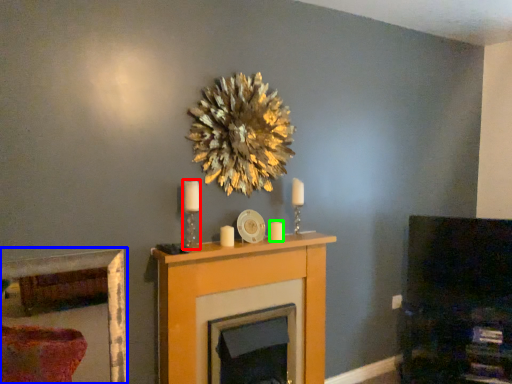
Question: Which object is the closest to the candle holder (highlighted by a red box)? Choose among these: picture frame (highlighted by a blue box) or candle (highlighted by a green box).

Choices:
 (A) picture frame
 (B) candle

Answer: (B)